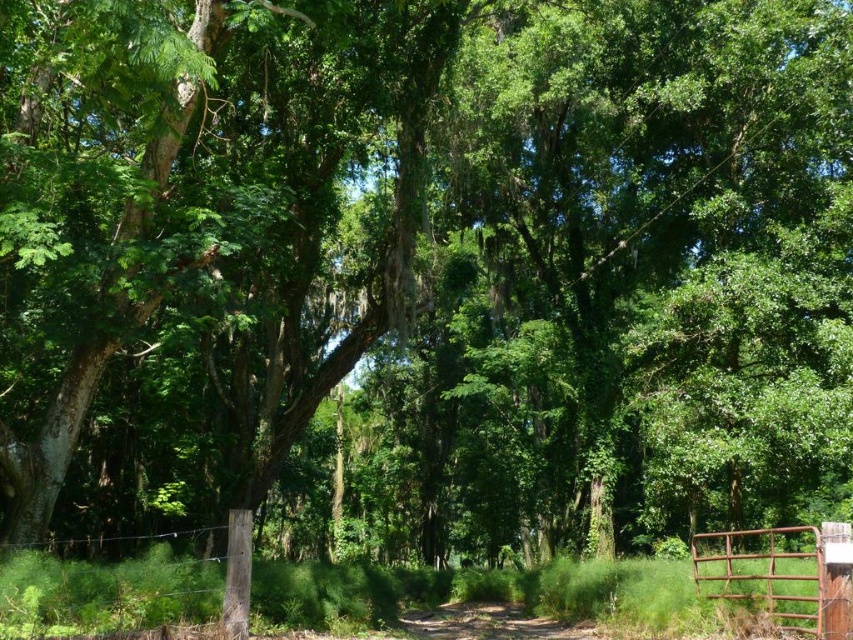
Question: Among these points, which one is farthest from the camera?

Choices:
 (A) (547, 636)
 (B) (723, 556)

Answer: (A)

Question: Where is rusty metal gate at lower right located in relation to brown dirt track at center in the image?

Choices:
 (A) left
 (B) right

Answer: (B)

Question: Is rusty metal gate at lower right to the right of brown dirt track at center from the viewer's perspective?

Choices:
 (A) no
 (B) yes

Answer: (B)

Question: Which point is farther to the camera?

Choices:
 (A) click(770, 584)
 (B) click(505, 620)

Answer: (B)

Question: Can you confirm if rusty metal gate at lower right is positioned to the right of brown dirt track at center?

Choices:
 (A) no
 (B) yes

Answer: (B)